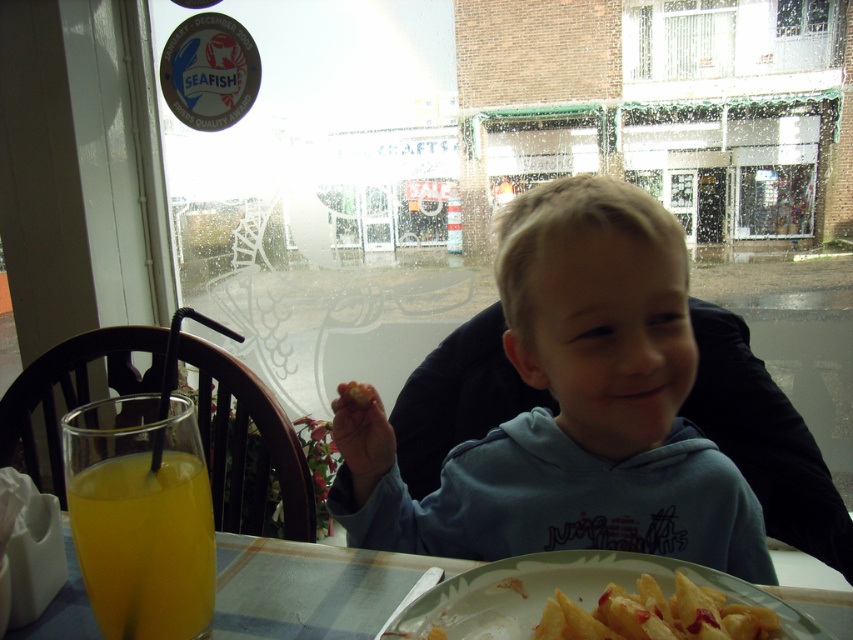
You are standing at the center of the room facing the window. There are two points marked on the window. The first point is at coordinate point (x=434, y=506) and the second point is at coordinate point (x=312, y=570). Which point is closer to you?

Point (x=312, y=570) is closer to you because it is in front of point (x=434, y=506).

You are a photographer trying to capture the light blue hoodie at center and the translucent orange juice at lower left in a single frame. Given that your camera can only focus on objects wider than 10 cm, can both items be captured clearly?

The light blue hoodie at center is wider than the translucent orange juice at lower left. Since the camera requires objects wider than 10 cm to focus, both items can be captured clearly as long as each meets the minimum width requirement. However, the description only states the hoodie is wider than the juice, not their exact measurements. Without knowing the exact widths, we cannot confirm if both exceed 10 cm.